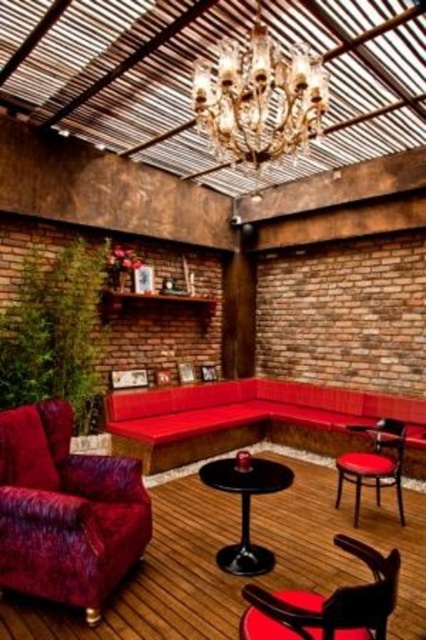
You are sitting on the velvet red couch at center and want to place a book on the shiny black table at center. Can you easily reach the table from your current position?

The velvet red couch at center is positioned over shiny black table at center, so the couch is directly above the table. This means the table is underneath the couch, making it impossible to reach from your current position.

You are sitting in the matte black chair at lower right and looking up. What object is directly above you in the crystal glass chandelier at upper center?

The crystal glass chandelier at upper center is directly above the matte black chair at lower right.